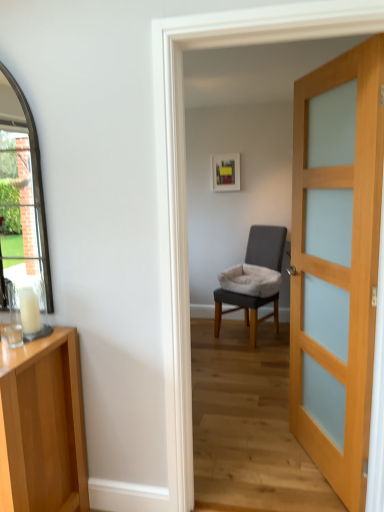
You are a GUI agent. You are given a task and a screenshot of the screen. Output one action in this format:
    pyautogui.click(x=<x>, y=<y>)
    Task: Click on the free region under gray fabric chair at center (from a real-world perspective)
    The width and height of the screenshot is (384, 512).
    Given the screenshot: What is the action you would take?
    pyautogui.click(x=244, y=340)